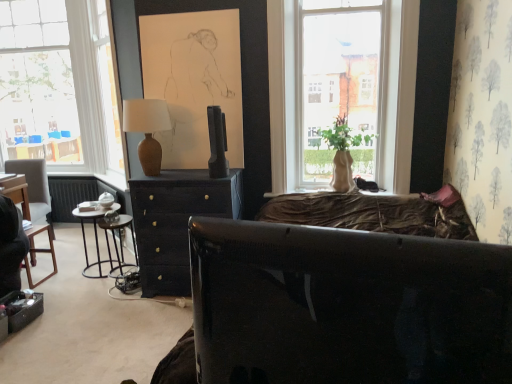
Describe the element at coordinates (120, 243) in the screenshot. I see `metallic bar stool at left, acting as the second bar stool starting from the left` at that location.

This screenshot has height=384, width=512. What do you see at coordinates (95, 239) in the screenshot?
I see `metallic black nightstand at left` at bounding box center [95, 239].

Where is `dark gray fabric chair at left`? dark gray fabric chair at left is located at coordinates (32, 206).

What do you see at coordinates (343, 153) in the screenshot?
I see `matte beige vase at window` at bounding box center [343, 153].

What do you see at coordinates (147, 129) in the screenshot?
I see `matte brown vase at center` at bounding box center [147, 129].

The width and height of the screenshot is (512, 384). I want to click on metallic bar stool at left, acting as the second bar stool starting from the left, so click(120, 243).

Which object is more forward, metallic black nightstand at left or metallic bar stool at left, placed as the 1th bar stool when sorted from right to left?

Positioned in front is metallic bar stool at left, placed as the 1th bar stool when sorted from right to left.

Considering the relative sizes of metallic black nightstand at left and metallic bar stool at left, acting as the second bar stool starting from the left, in the image provided, is metallic black nightstand at left wider than metallic bar stool at left, acting as the second bar stool starting from the left,?

Yes.

Considering the sizes of objects metallic black nightstand at left and metallic bar stool at left, placed as the 1th bar stool when sorted from right to left, in the image provided, who is smaller, metallic black nightstand at left or metallic bar stool at left, placed as the 1th bar stool when sorted from right to left,?

metallic bar stool at left, placed as the 1th bar stool when sorted from right to left, is smaller.

Consider the image. Considering the sizes of objects metallic black nightstand at left and metallic bar stool at left, placed as the 1th bar stool when sorted from right to left, in the image provided, who is taller, metallic black nightstand at left or metallic bar stool at left, placed as the 1th bar stool when sorted from right to left,?

metallic black nightstand at left.

Based on the photo, from a real-world perspective, between matte brown vase at center and slate gray stone television at center, who is vertically higher?

matte brown vase at center, from a real-world perspective.

Is matte brown vase at center turned away from slate gray stone television at center?

No, matte brown vase at center is not facing the opposite direction of slate gray stone television at center.

Does matte brown vase at center touch slate gray stone television at center?

No, matte brown vase at center is not touching slate gray stone television at center.

How different are the orientations of matte brown vase at center and slate gray stone television at center in degrees?

The angular difference between matte brown vase at center and slate gray stone television at center is 4.6e-05 degrees.

Which object is further away from the camera, glossy black studio couch at center or wooden bar stool at lower left, the 2th bar stool positioned from the right?

wooden bar stool at lower left, the 2th bar stool positioned from the right.

You are a GUI agent. You are given a task and a screenshot of the screen. Output one action in this format:
    pyautogui.click(x=<x>, y=<y>)
    Task: Click on the studio couch above the wooden bar stool at lower left, the 2th bar stool positioned from the right (from the image's perspective)
    Image resolution: width=512 pixels, height=384 pixels.
    Given the screenshot: What is the action you would take?
    pyautogui.click(x=346, y=306)

Is glossy black studio couch at center not within wooden bar stool at lower left, the 2th bar stool positioned from the right?

Yes.

From a real-world perspective, which object stands above the other?

glossy black studio couch at center, from a real-world perspective.

Is matte beige vase at window oriented towards dark gray fabric chair at left?

No, matte beige vase at window is not turned towards dark gray fabric chair at left.

Is matte beige vase at window next to dark gray fabric chair at left?

No, matte beige vase at window is not touching dark gray fabric chair at left.

Is matte beige vase at window completely or partially outside of dark gray fabric chair at left?

Yes, matte beige vase at window is outside of dark gray fabric chair at left.

From the picture: Between matte beige vase at window and dark gray fabric chair at left, which one has larger width?

With larger width is dark gray fabric chair at left.

Can you confirm if matte brown vase at center is smaller than transparent glass window at left?

Yes, matte brown vase at center is smaller than transparent glass window at left.

Which object is wider, matte brown vase at center or transparent glass window at left?

Wider between the two is matte brown vase at center.

Is the position of matte brown vase at center less distant than that of transparent glass window at left?

Yes, matte brown vase at center is closer to the viewer.

From their relative heights in the image, would you say dark gray fabric chair at left is taller or shorter than metallic black nightstand at left?

Considering their sizes, dark gray fabric chair at left has more height than metallic black nightstand at left.

Is dark gray fabric chair at left completely or partially outside of metallic black nightstand at left?

dark gray fabric chair at left lies outside metallic black nightstand at left's area.

Is metallic black nightstand at left at the back of dark gray fabric chair at left?

No, dark gray fabric chair at left is not facing the opposite direction of metallic black nightstand at left.

From a real-world perspective, is dark gray fabric chair at left beneath transparent glass window at left?

Yes, from a real-world perspective, dark gray fabric chair at left is below transparent glass window at left.

Are dark gray fabric chair at left and transparent glass window at left located far from each other?

dark gray fabric chair at left is positioned a significant distance from transparent glass window at left.

Is dark gray fabric chair at left in front of transparent glass window at left?

Yes, it is in front of transparent glass window at left.

Does dark gray fabric chair at left have a greater height compared to transparent glass window at left?

Incorrect, the height of dark gray fabric chair at left is not larger of that of transparent glass window at left.

From the image's perspective, starting from the metallic black nightstand at left, which bar stool is the 1st one below? Please provide its 2D coordinates.

[(120, 243)]

At what (x,y) coordinates should I click in order to perform the action: click on lamp that is above the slate gray stone television at center (from the image's perspective). Please return your answer as a coordinate pair (x, y). This screenshot has height=384, width=512. Looking at the image, I should click on (147, 129).

From the image, which object appears to be nearer to metallic bar stool at left, acting as the second bar stool starting from the left, dark gray fabric chair at left or slate gray stone television at center?

dark gray fabric chair at left is positioned closer to the anchor metallic bar stool at left, acting as the second bar stool starting from the left.

Which object lies nearer to the anchor point glossy black studio couch at center, transparent glass window at left or dark gray fabric chair at left?

Among the two, transparent glass window at left is located nearer to glossy black studio couch at center.

Looking at the image, which one is located closer to matte dark wood dresser at center, matte beige vase at window or slate gray stone television at center?

Based on the image, slate gray stone television at center appears to be nearer to matte dark wood dresser at center.

Considering their positions, is dark gray fabric chair at left positioned further to metallic black nightstand at left than matte brown vase at center?

matte brown vase at center is further to metallic black nightstand at left.

When comparing their distances from wooden bar stool at lower left, the 2th bar stool positioned from the right, does matte beige vase at window or metallic black nightstand at left seem closer?

metallic black nightstand at left lies closer to wooden bar stool at lower left, the 2th bar stool positioned from the right, than the other object.

Based on their spatial positions, is metallic bar stool at left, acting as the second bar stool starting from the left, or wooden bar stool at lower left, acting as the first bar stool starting from the left, closer to matte beige vase at window?

metallic bar stool at left, acting as the second bar stool starting from the left.

Considering their positions, is matte beige vase at window positioned further to dark gray fabric chair at left than matte brown vase at center?

Among the two, matte beige vase at window is located further to dark gray fabric chair at left.

Considering their positions, is transparent glass window at left positioned further to matte beige vase at window than metallic bar stool at left, acting as the second bar stool starting from the left?

Based on the image, transparent glass window at left appears to be further to matte beige vase at window.

The width and height of the screenshot is (512, 384). Identify the location of chair that lies between transparent glass window at left and metallic bar stool at left, placed as the 1th bar stool when sorted from right to left, from top to bottom. (32, 206).

I want to click on television between wooden bar stool at lower left, acting as the first bar stool starting from the left, and matte beige vase at window, in the horizontal direction, so click(x=217, y=143).

Identify the location of desk between glossy black studio couch at center and wooden bar stool at lower left, the 2th bar stool positioned from the right, along the z-axis. This screenshot has height=384, width=512. (176, 222).

The height and width of the screenshot is (384, 512). In order to click on bar stool between transparent glass window at left and wooden bar stool at lower left, acting as the first bar stool starting from the left, from top to bottom in this screenshot , I will do (120, 243).